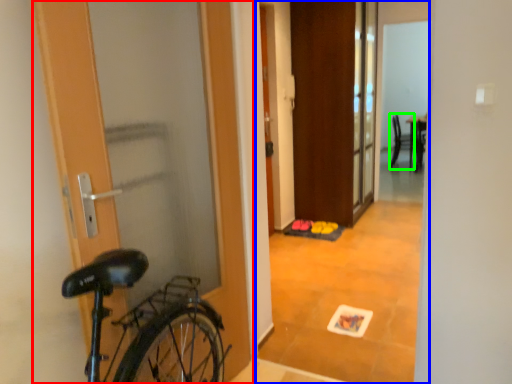
Question: Based on their relative distances, which object is nearer to door (highlighted by a red box)? Choose from corridor (highlighted by a blue box) and chair (highlighted by a green box).

Choices:
 (A) corridor
 (B) chair

Answer: (A)